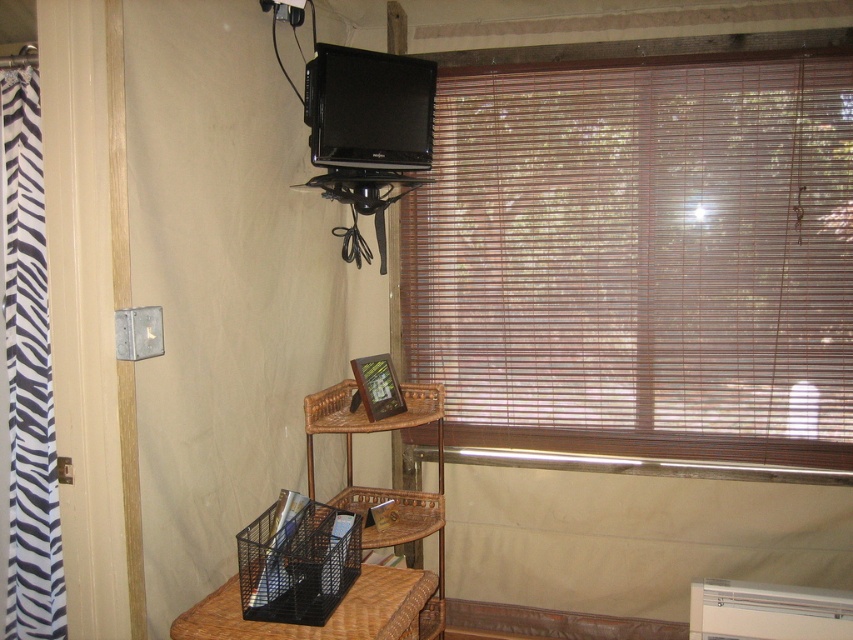
You are standing in the room and want to move from the point at coordinates point (451, 340) to the point at coordinates point (378, 56). Since you can only move forward, will you be able to reach the second point without moving sideways or backward?

Point (451, 340) is behind point (378, 56), so you cannot reach the second point without moving sideways or backward because you can only move forward.

You are organizing items in the room and need to place a new plant pot between the brown wood blinds at upper right and the black mesh basket at lower center. Based on their positions, where should you position the plant pot to ensure it is between them?

The plant pot should be placed to the left of the brown wood blinds at upper right and to the right of the black mesh basket at lower center since the brown wood blinds at upper right is positioned to the right of the black mesh basket at lower center.